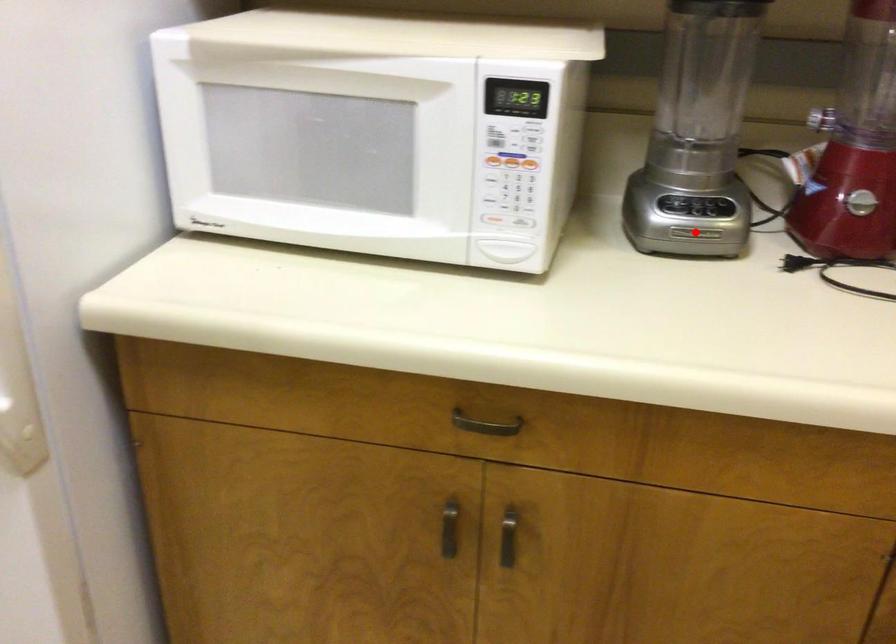
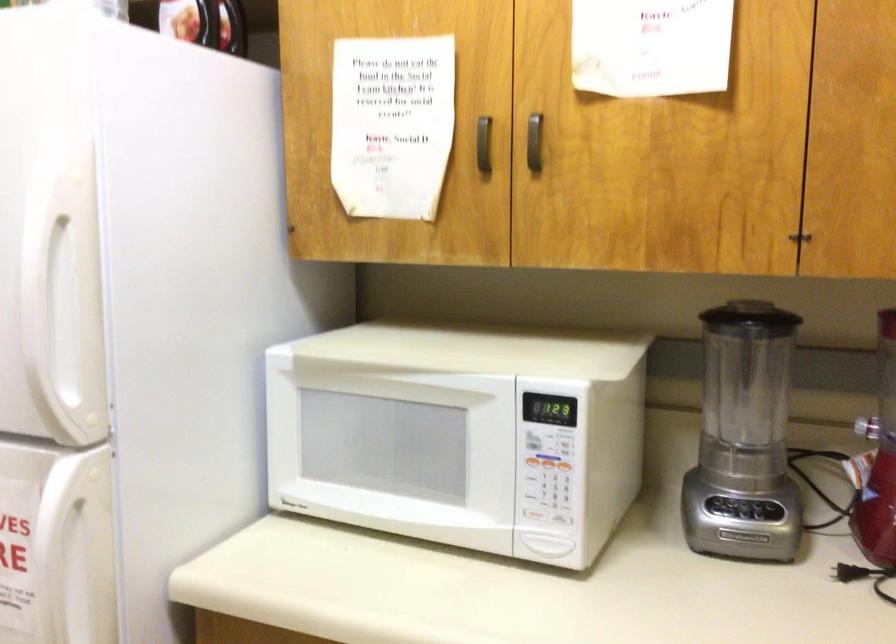
Locate, in the second image, the point that corresponds to the highlighted location in the first image.

(743, 536)